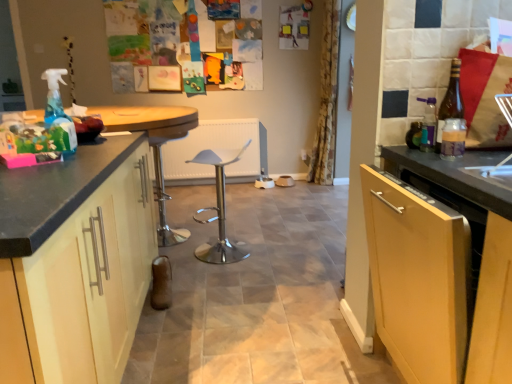
You are a GUI agent. You are given a task and a screenshot of the screen. Output one action in this format:
    pyautogui.click(x=<x>, y=<y>)
    Task: Click on the free space to the back side of polished chrome bar stool at center, the 1th bar stool from the left
    The height and width of the screenshot is (384, 512).
    Given the screenshot: What is the action you would take?
    pyautogui.click(x=183, y=220)